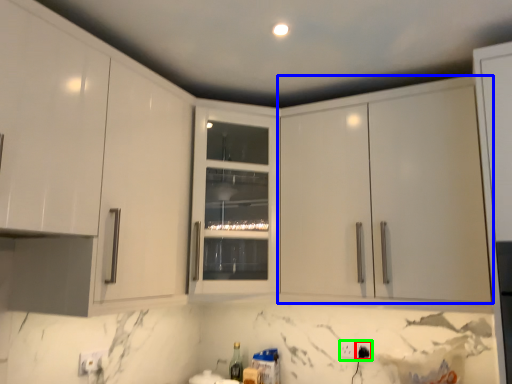
Question: Based on their relative distances, which object is farther from electric outlet (highlighted by a red box)? Choose from cabinetry (highlighted by a blue box) and electric outlet (highlighted by a green box).

Choices:
 (A) cabinetry
 (B) electric outlet

Answer: (A)